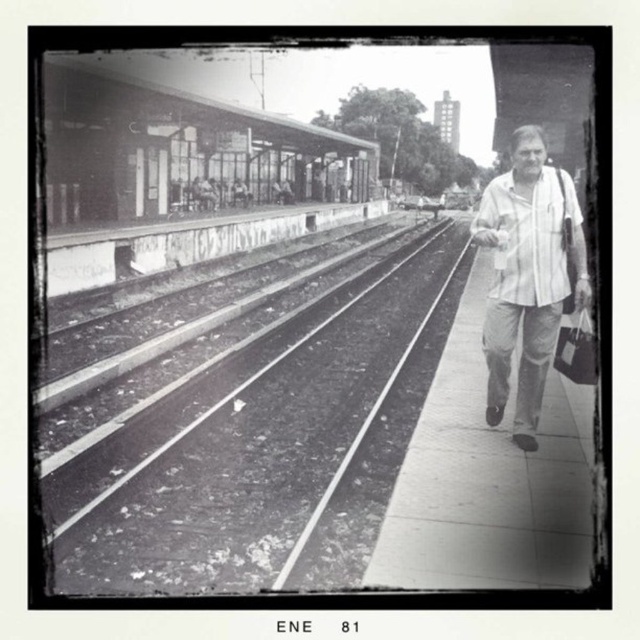
Question: From the image, what is the correct spatial relationship of smooth concrete tracks at center in relation to white cotton shirt at right?

Choices:
 (A) right
 (B) left

Answer: (B)

Question: Which object is closer to the camera taking this photo?

Choices:
 (A) white cotton shirt at right
 (B) smooth concrete tracks at center

Answer: (B)

Question: Is smooth concrete tracks at center behind white cotton shirt at right?

Choices:
 (A) no
 (B) yes

Answer: (A)

Question: Which point appears farthest from the camera in this image?

Choices:
 (A) (500, 208)
 (B) (84, 532)

Answer: (B)

Question: Which of the following is the farthest from the observer?

Choices:
 (A) (378, 336)
 (B) (547, 168)

Answer: (A)

Question: Can you confirm if smooth concrete tracks at center is thinner than white cotton shirt at right?

Choices:
 (A) yes
 (B) no

Answer: (B)